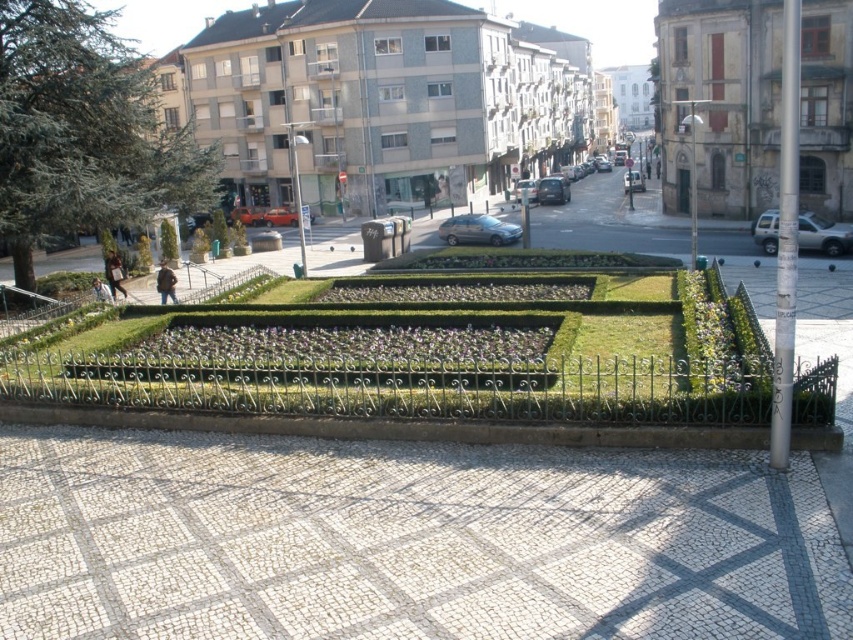
Can you confirm if white mosaic tiles at center is bigger than green grassy garden at center?

No.

Does white mosaic tiles at center have a greater width compared to green grassy garden at center?

No.

Identify the location of white mosaic tiles at center. The width and height of the screenshot is (853, 640). (405, 541).

Which is below, green grassy garden at center or green leafy plant at center?

green leafy plant at center is below.

At what (x,y) coordinates should I click in order to perform the action: click on green grassy garden at center. Please return your answer as a coordinate pair (x, y). Image resolution: width=853 pixels, height=640 pixels. Looking at the image, I should click on (405, 387).

Does point (59, 372) come in front of point (146, 362)?

That is False.

The image size is (853, 640). Identify the location of green grassy garden at center. (405, 387).

Does point (109, 605) lie in front of point (346, 348)?

Yes, it is.

Is white mosaic tiles at center shorter than green leafy plant at center?

Incorrect, white mosaic tiles at center's height does not fall short of green leafy plant at center's.

Image resolution: width=853 pixels, height=640 pixels. What do you see at coordinates (405, 541) in the screenshot?
I see `white mosaic tiles at center` at bounding box center [405, 541].

Locate an element on the screen. This screenshot has height=640, width=853. white mosaic tiles at center is located at coordinates (405, 541).